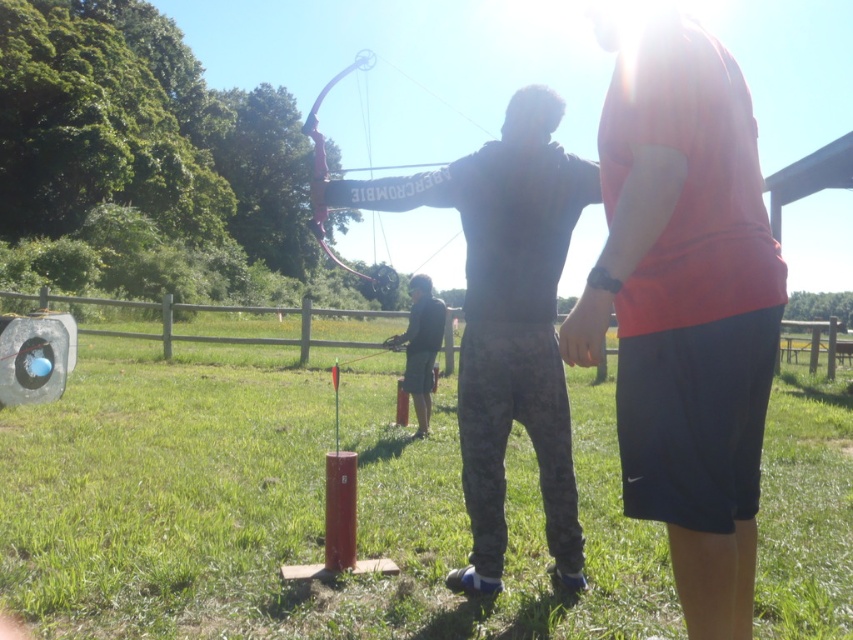
Question: Among these objects, which one is farthest from the camera?

Choices:
 (A) camouflage pants at center
 (B) pink matte bow at center
 (C) orange fabric shirt at upper right

Answer: (A)

Question: Does orange fabric shirt at upper right appear over pink matte bow at center?

Choices:
 (A) no
 (B) yes

Answer: (A)

Question: Which object is the closest to the camouflage pants at center?

Choices:
 (A) orange fabric shirt at upper right
 (B) pink matte bow at center

Answer: (A)

Question: Which of the following is the closest to the observer?

Choices:
 (A) camouflage pants at center
 (B) orange fabric shirt at upper right

Answer: (B)

Question: Does orange fabric shirt at upper right appear over camouflage pants at center?

Choices:
 (A) yes
 (B) no

Answer: (A)

Question: Is orange fabric shirt at upper right in front of pink matte bow at center?

Choices:
 (A) yes
 (B) no

Answer: (A)